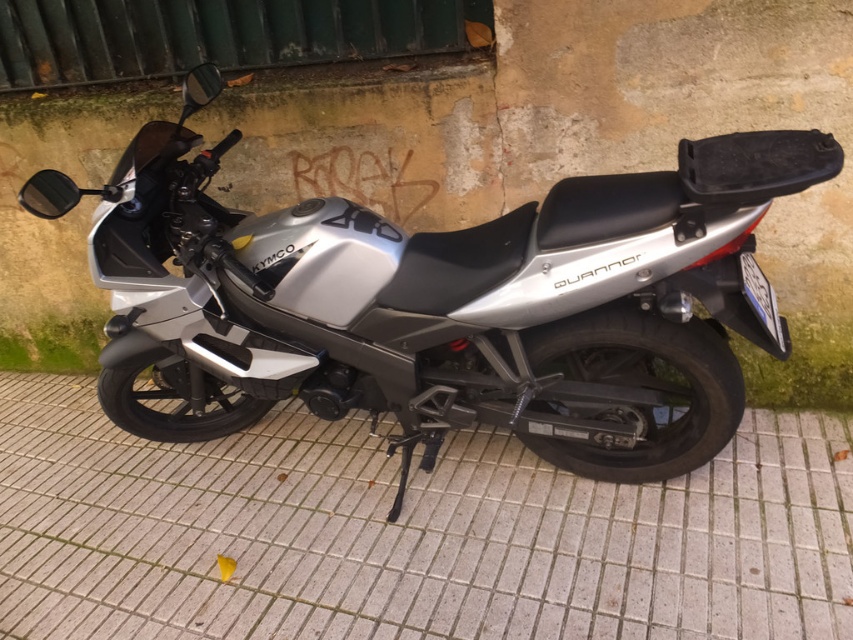
Where is the silver metallic motorcycle at center located in the image?

The silver metallic motorcycle at center is located at point (444, 301) in the image.

You are a delivery person who needs to park your motorcycle in a spot that is directly in front of the white tile pavement at center. Can you park your silver metallic motorcycle at center there?

The silver metallic motorcycle at center is already positioned in front of the white tile pavement at center, so yes, it can be parked there as requested.

You are standing in front of a Kymco Quannon motorcycle parked on a tiled pavement. You notice a point marked at coordinates (444, 301). Based on the scene, can you determine what object this point is located on?

The point at coordinates (444, 301) is located on the silver metallic motorcycle at center.